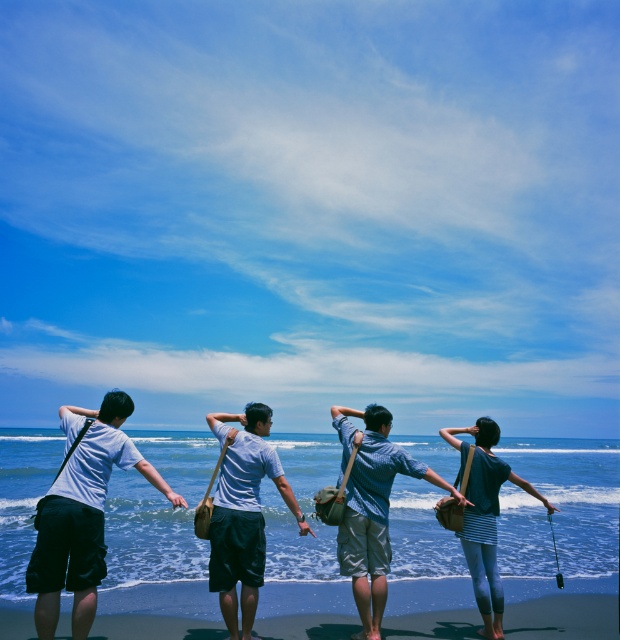
Question: Where is white matte t-shirt at left located in relation to smooth skin hand at center in the image?

Choices:
 (A) left
 (B) right

Answer: (A)

Question: Does white matte t-shirt at center appear under smooth skin hand at center?

Choices:
 (A) yes
 (B) no

Answer: (A)

Question: Which of the following is the farthest from the observer?

Choices:
 (A) (467, 429)
 (B) (463, 608)
 (C) (50, 531)

Answer: (B)

Question: In this image, where is white matte t-shirt at left located relative to blue striped shirt at center?

Choices:
 (A) below
 (B) above

Answer: (A)

Question: Based on their relative distances, which object is farther from the blue striped shirt at center?

Choices:
 (A) smooth skin hand at center
 (B) white matte t-shirt at center
 (C) white matte t-shirt at left

Answer: (A)

Question: Which object appears farthest from the camera in this image?

Choices:
 (A) smooth sand at lower center
 (B) blue striped shirt at center
 (C) white matte t-shirt at left

Answer: (A)